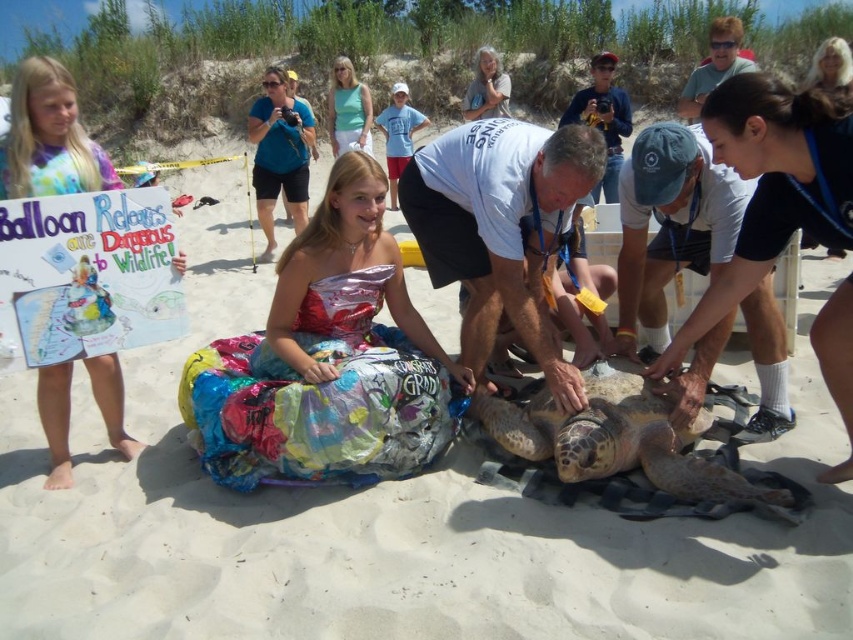
Describe the element at coordinates (622, 454) in the screenshot. I see `leathery brown turtle at center` at that location.

Does point (666, 452) come behind point (33, 72)?

Yes, it is behind point (33, 72).

Does point (614, 509) come farther from viewer compared to point (108, 381)?

No, it is in front of (108, 381).

Locate an element on the screen. The height and width of the screenshot is (640, 853). leathery brown turtle at center is located at coordinates (622, 454).

How much distance is there between blue fabric camera at upper center and green cotton shirt at upper center?

blue fabric camera at upper center and green cotton shirt at upper center are 2.28 meters apart from each other.

Which of these two, blue fabric camera at upper center or green cotton shirt at upper center, stands taller?

Standing taller between the two is blue fabric camera at upper center.

Find the location of `blue fabric camera at upper center`. blue fabric camera at upper center is located at coordinates (279, 154).

Which is in front, point (54, 99) or point (308, 148)?

Point (54, 99)

Who is positioned more to the right, pastel tie-dye shirt at left or blue fabric camera at upper center?

blue fabric camera at upper center is more to the right.

Which is in front, point (96, 154) or point (254, 157)?

Point (96, 154) is in front.

At what (x,y) coordinates should I click in order to perform the action: click on pastel tie-dye shirt at left. Please return your answer as a coordinate pair (x, y). The width and height of the screenshot is (853, 640). Looking at the image, I should click on pyautogui.click(x=49, y=138).